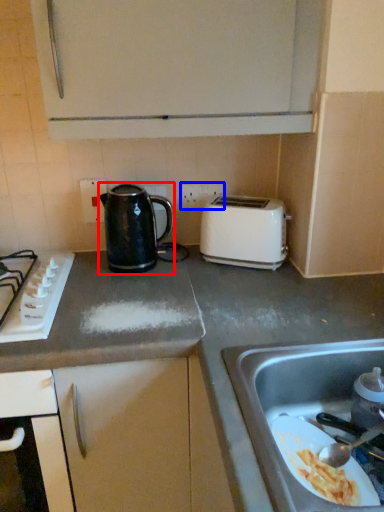
Question: Which of the following is the farthest to the observer, kettle (highlighted by a red box) or electric outlet (highlighted by a blue box)?

Choices:
 (A) kettle
 (B) electric outlet

Answer: (B)